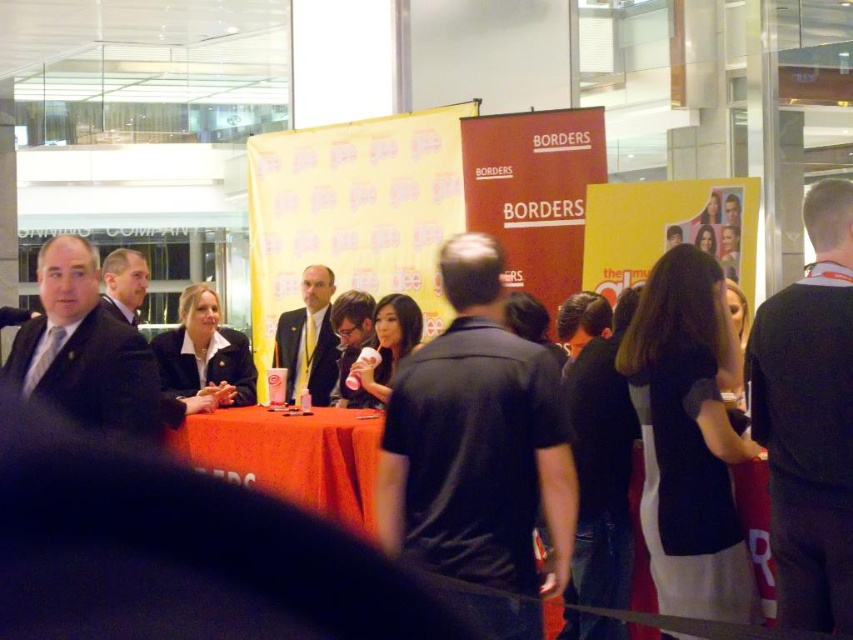
You are at the event and need to find the matte black suit at left. Where exactly is it located in the room?

The matte black suit at left is located at point 0.594 on the x axis and 0.125 on the y axis.

You are attending an event and need to find the black fabric business suit at center and the matte black suit at left. From the perspective of someone standing at the entrance, which suit is closer to the left side of the table?

The matte black suit at left is closer to the left side of the table because it is positioned to the left of the black fabric business suit at center.

You are standing in the middle of the room and want to locate the black matte shirt at center. According to the coordinates provided, in which direction should you move relative to your current position?

The black matte shirt at center is located at coordinates approximately 0.691 on the x axis and 0.560 on the y axis. Since you are at the center of the room, which would be coordinates 0.5 on both axes, you should move northeast to reach it.